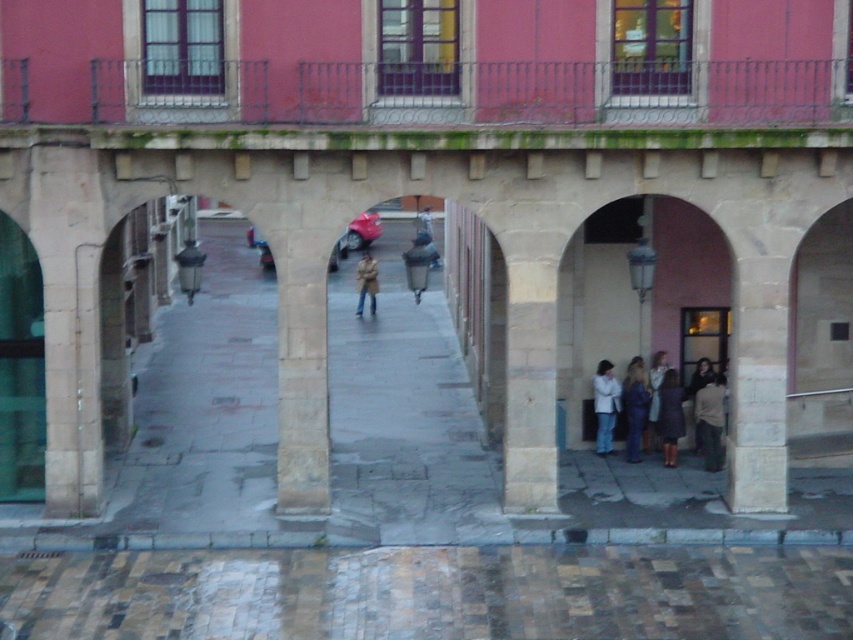
Does white textured coat at lower right have a lesser height compared to dark brown leather coat at lower right?

Incorrect, white textured coat at lower right's height does not fall short of dark brown leather coat at lower right's.

Which is in front, point (659, 445) or point (703, 384)?

Positioned in front is point (703, 384).

Who is more forward, (653,417) or (689,385)?

Point (653,417) is in front.

Find the location of a particular element. This screenshot has width=853, height=640. white textured coat at lower right is located at coordinates (654, 396).

Which is above, light beige coat at center or tan leather jacket at center?

tan leather jacket at center is above.

Based on the photo, does light beige coat at center appear over tan leather jacket at center?

No, light beige coat at center is not above tan leather jacket at center.

Between point (676, 433) and point (369, 307), which one is positioned behind?

The point (369, 307) is more distant.

Locate an element on the screen. light beige coat at center is located at coordinates (693, 410).

At what (x,y) coordinates should I click in order to perform the action: click on denim jacket at lower right. Please return your answer as a coordinate pair (x, y). The height and width of the screenshot is (640, 853). Looking at the image, I should click on (635, 406).

Is point (636, 368) farther from camera compared to point (654, 355)?

No, it is not.

Does point (633, 422) lie in front of point (656, 419)?

No, (633, 422) is further to viewer.

The width and height of the screenshot is (853, 640). I want to click on denim jacket at lower right, so click(x=635, y=406).